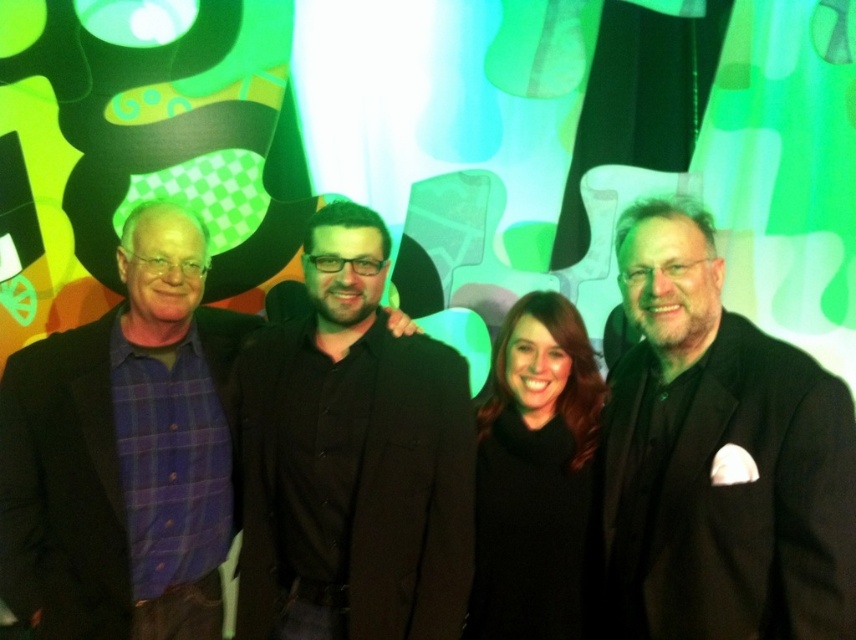
You are a fashion designer observing the group of people in the image. You need to determine the layering of their clothing. Which clothing item is positioned higher on the body between the black matte coat at center and the black woolen sweater at center?

The black matte coat at center is located above the black woolen sweater at center, meaning the coat is worn over the sweater.

You are standing in front of the image. There is a point marked at coordinates (122, 452). Which object from the scene does this point correspond to?

The point at coordinates (122, 452) corresponds to the purple plaid shirt at left.

You are a tailor measuring the distance between two black items in the image. The items are the black matte coat at center and the black woolen sweater at center. The tailor needs to know if the distance between them is more than 25 centimeters to decide if they can be moved closer without overlapping. Is the distance sufficient?

The black matte coat at center and the black woolen sweater at center are 27.58 centimeters apart from each other. Since 27.58 cm is greater than 25 cm, the distance is sufficient, so the tailor can move them closer without overlapping.